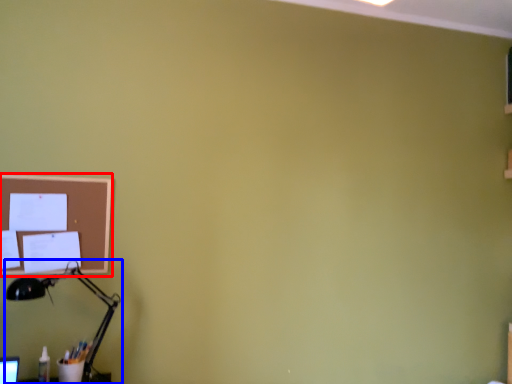
Question: Which point is further to the camera, bulletin board (highlighted by a red box) or lamp (highlighted by a blue box)?

Choices:
 (A) bulletin board
 (B) lamp

Answer: (A)